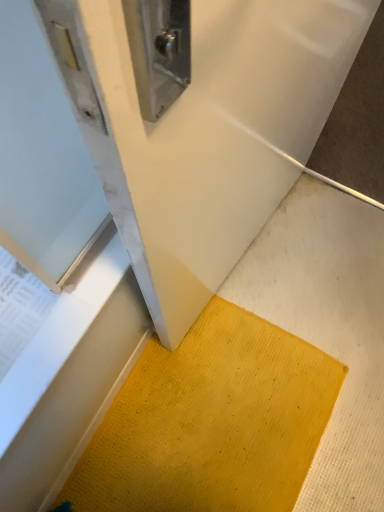
Question: Is yellow textured mat at lower center inside the boundaries of yellow textured mat at lower center, or outside?

Choices:
 (A) inside
 (B) outside

Answer: (B)

Question: From a real-world perspective, is yellow textured mat at lower center physically located above or below yellow textured mat at lower center?

Choices:
 (A) above
 (B) below

Answer: (B)

Question: Is yellow textured mat at lower center to the left or to the right of yellow textured mat at lower center in the image?

Choices:
 (A) left
 (B) right

Answer: (A)

Question: Is yellow textured mat at lower center inside or outside of yellow textured mat at lower center?

Choices:
 (A) inside
 (B) outside

Answer: (B)

Question: Considering their positions, is yellow textured mat at lower center located in front of or behind yellow textured mat at lower center?

Choices:
 (A) behind
 (B) front

Answer: (B)

Question: Considering the positions of point (294, 42) and point (72, 486), is point (294, 42) closer or farther from the camera than point (72, 486)?

Choices:
 (A) closer
 (B) farther

Answer: (A)

Question: Is yellow textured mat at lower center taller or shorter than yellow textured mat at lower center?

Choices:
 (A) tall
 (B) short

Answer: (A)